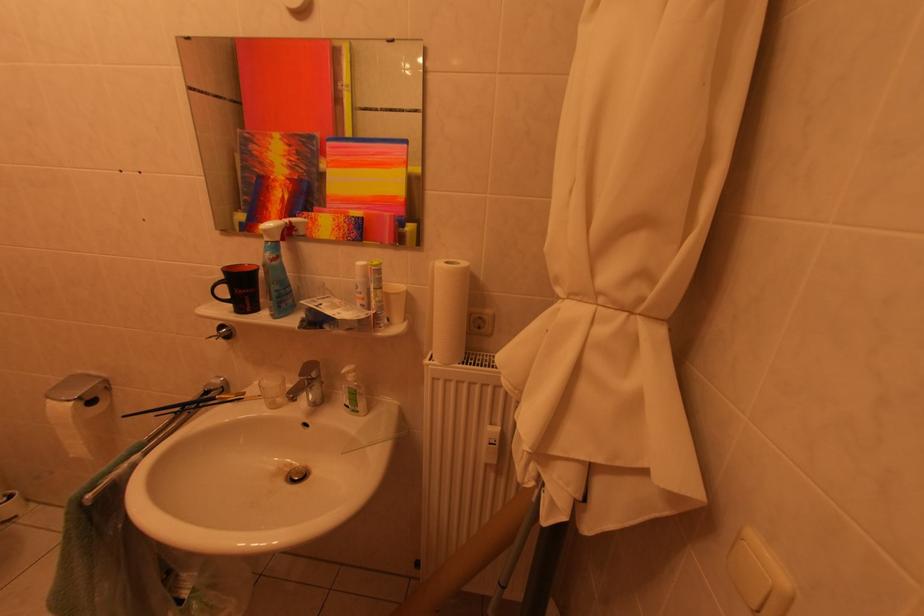
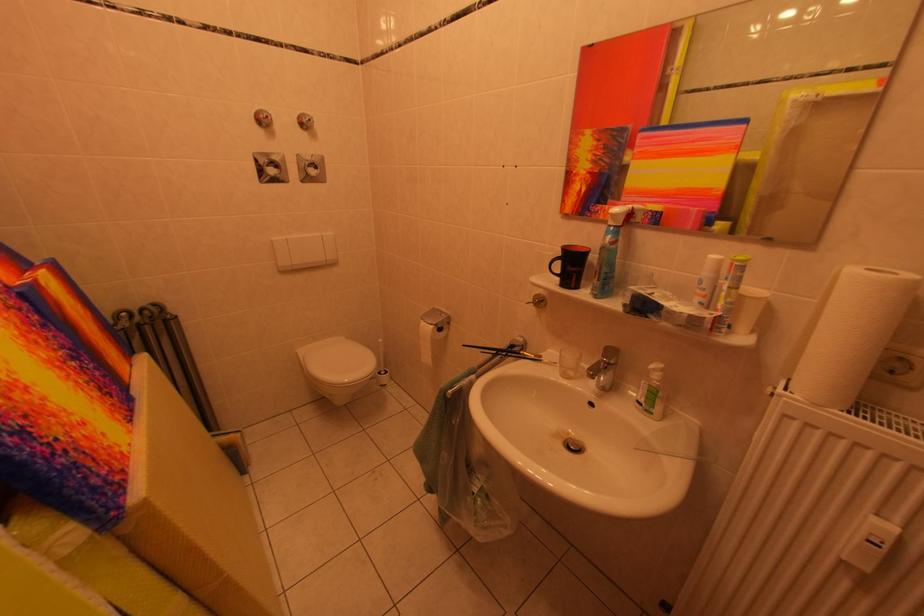
Locate, in the second image, the point that corresponds to point (309, 379) in the first image.

(612, 360)